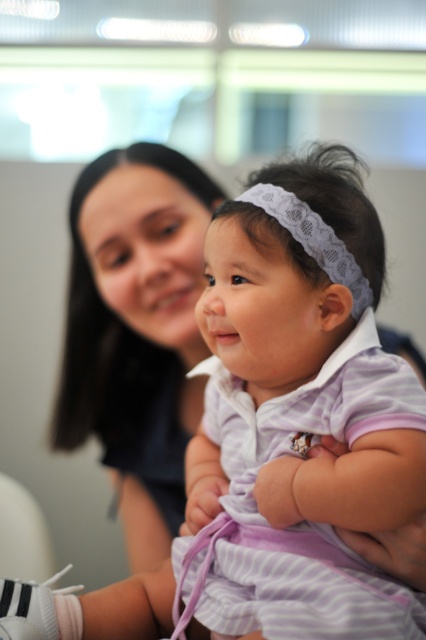
Question: Which point appears farthest from the camera in this image?

Choices:
 (A) (328, 259)
 (B) (285, 177)

Answer: (B)

Question: Does purple striped dress at center have a smaller size compared to white lace headband at center?

Choices:
 (A) yes
 (B) no

Answer: (B)

Question: Can you confirm if purple striped dress at center is smaller than white lace headband at center?

Choices:
 (A) no
 (B) yes

Answer: (A)

Question: In this image, where is purple striped dress at center located relative to white lace headband at center?

Choices:
 (A) left
 (B) right

Answer: (A)